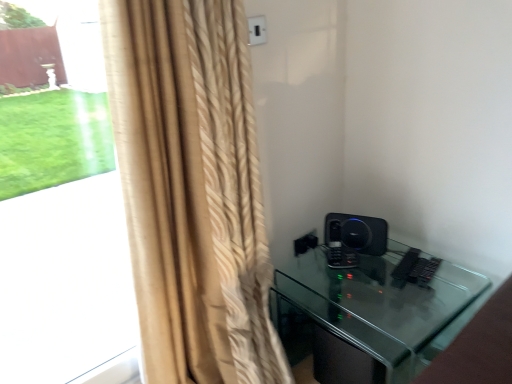
What is the approximate height of black matte speaker at right?

The height of black matte speaker at right is 5.37 inches.

Locate an element on the screen. This screenshot has height=384, width=512. black glass table at lower right is located at coordinates (380, 305).

Identify the location of beige textured curtain at left. Image resolution: width=512 pixels, height=384 pixels. click(67, 286).

Can you confirm if black matte speaker at right is smaller than beige textured curtain at left?

Correct, black matte speaker at right occupies less space than beige textured curtain at left.

Where is `speaker lying below the beige textured curtain at left (from the image's perspective)`? Image resolution: width=512 pixels, height=384 pixels. speaker lying below the beige textured curtain at left (from the image's perspective) is located at coordinates (358, 233).

Is black matte speaker at right in front of beige textured curtain at left?

No, black matte speaker at right is further to the viewer.

Which is in front, point (45, 327) or point (185, 41)?

Point (185, 41)

Which object is further away from the camera taking this photo, beige textured curtain at left or beige textured curtain at left?

beige textured curtain at left is further from the camera.

Which object is thinner, beige textured curtain at left or beige textured curtain at left?

beige textured curtain at left.

In the scene shown: From a real-world perspective, is black glass table at lower right located beneath beige textured curtain at left?

Yes.

Looking at this image, is black glass table at lower right situated inside beige textured curtain at left or outside?

The correct answer is: outside.

Does point (349, 294) appear closer or farther from the camera than point (110, 339)?

Point (349, 294) is closer to the camera than point (110, 339).

Which of these two, black glass table at lower right or beige textured curtain at left, stands shorter?

black glass table at lower right is shorter.

Considering the points (369, 224) and (340, 320), which point is in front, point (369, 224) or point (340, 320)?

Point (340, 320)

Locate an element on the screen. The image size is (512, 384). speaker behind the black glass table at lower right is located at coordinates (358, 233).

Does black matte speaker at right lie in front of black glass table at lower right?

No, the depth of black matte speaker at right is greater than that of black glass table at lower right.

How much distance is there between black matte speaker at right and black glass table at lower right?

A distance of 9.60 inches exists between black matte speaker at right and black glass table at lower right.

Is beige textured curtain at left not close to black matte speaker at right?

That's not correct — beige textured curtain at left is a little close to black matte speaker at right.

From a real-world perspective, which is physically above, beige textured curtain at left or black matte speaker at right?

beige textured curtain at left is physically above.

Which is less distant, (244, 212) or (362, 232)?

The point (244, 212) is more forward.

Locate an element on the screen. Image resolution: width=512 pixels, height=384 pixels. bay window lying behind the beige textured curtain at left is located at coordinates (67, 286).

Considering the relative sizes of beige textured curtain at left and beige textured curtain at left in the image provided, is beige textured curtain at left smaller than beige textured curtain at left?

No, beige textured curtain at left is not smaller than beige textured curtain at left.

Which object is closer to the camera, beige textured curtain at left or beige textured curtain at left?

beige textured curtain at left is closer to the camera.

Between beige textured curtain at left and beige textured curtain at left, which one appears on the left side from the viewer's perspective?

beige textured curtain at left.

Is point (170, 189) positioned before point (428, 345)?

No, it is not.

Which is correct: beige textured curtain at left is inside black glass table at lower right, or outside of it?

beige textured curtain at left is not enclosed by black glass table at lower right.

Considering the positions of objects beige textured curtain at left and black glass table at lower right in the image provided, who is more to the left, beige textured curtain at left or black glass table at lower right?

From the viewer's perspective, beige textured curtain at left appears more on the left side.

From the image's perspective, which is above, beige textured curtain at left or black glass table at lower right?

beige textured curtain at left.

Image resolution: width=512 pixels, height=384 pixels. Find the location of `speaker behind the beige textured curtain at left`. speaker behind the beige textured curtain at left is located at coordinates (358, 233).

Image resolution: width=512 pixels, height=384 pixels. What are the coordinates of `curtain that is on the right side of beige textured curtain at left` in the screenshot? It's located at point(191,189).

Which object lies further to the anchor point beige textured curtain at left, black matte speaker at right or black glass table at lower right?

black matte speaker at right lies further to beige textured curtain at left than the other object.

Estimate the real-world distances between objects in this image. Which object is closer to black matte speaker at right, black glass table at lower right or beige textured curtain at left?

Among the two, black glass table at lower right is located nearer to black matte speaker at right.

Considering their positions, is black matte speaker at right positioned closer to beige textured curtain at left than beige textured curtain at left?

Based on the image, black matte speaker at right appears to be nearer to beige textured curtain at left.

Considering their positions, is beige textured curtain at left positioned closer to beige textured curtain at left than black matte speaker at right?

Based on the image, beige textured curtain at left appears to be nearer to beige textured curtain at left.

Based on their spatial positions, is beige textured curtain at left or black glass table at lower right further from beige textured curtain at left?

black glass table at lower right is positioned further to the anchor beige textured curtain at left.

Looking at the image, which one is located further to black glass table at lower right, beige textured curtain at left or black matte speaker at right?

beige textured curtain at left is further to black glass table at lower right.

When comparing their distances from black matte speaker at right, does beige textured curtain at left or beige textured curtain at left seem closer?

The object closer to black matte speaker at right is beige textured curtain at left.

Estimate the real-world distances between objects in this image. Which object is further from black glass table at lower right, black matte speaker at right or beige textured curtain at left?

Among the two, beige textured curtain at left is located further to black glass table at lower right.

The width and height of the screenshot is (512, 384). I want to click on furniture positioned between beige textured curtain at left and black matte speaker at right from near to far, so tap(380, 305).

I want to click on curtain between beige textured curtain at left and black matte speaker at right, so click(x=191, y=189).

I want to click on speaker situated between beige textured curtain at left and black glass table at lower right from left to right, so click(x=358, y=233).

In order to click on curtain between beige textured curtain at left and black glass table at lower right from left to right in this screenshot , I will do `click(191, 189)`.